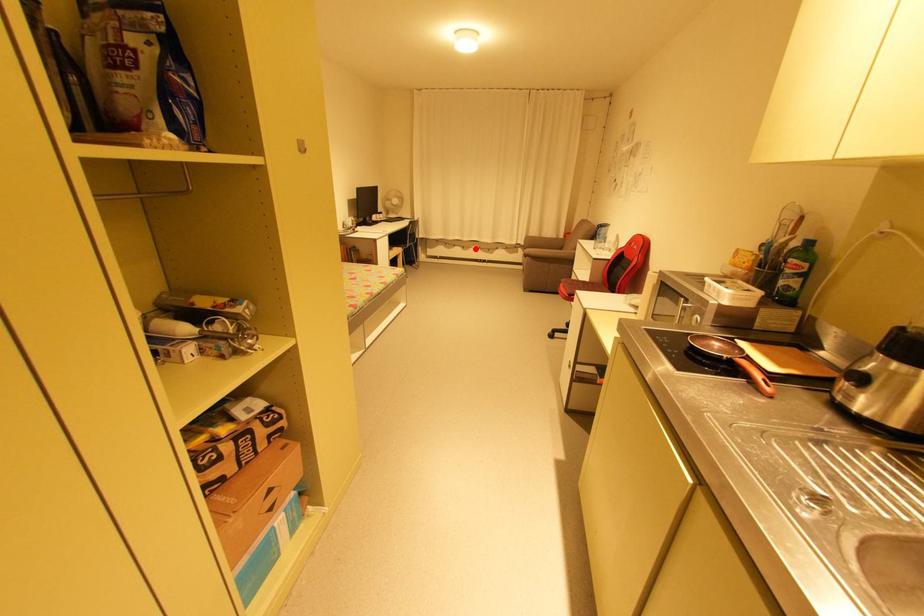
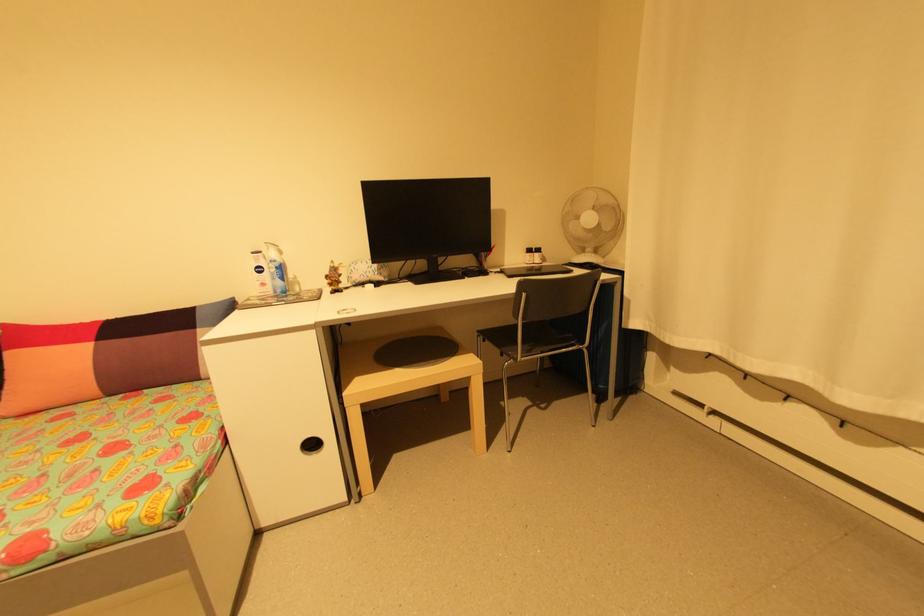
Question: I am providing you with two images of the same scene from different viewpoints. A red point is marked on the first image. Can you still see the location of the red point in image 2?

Choices:
 (A) Yes
 (B) No

Answer: (A)